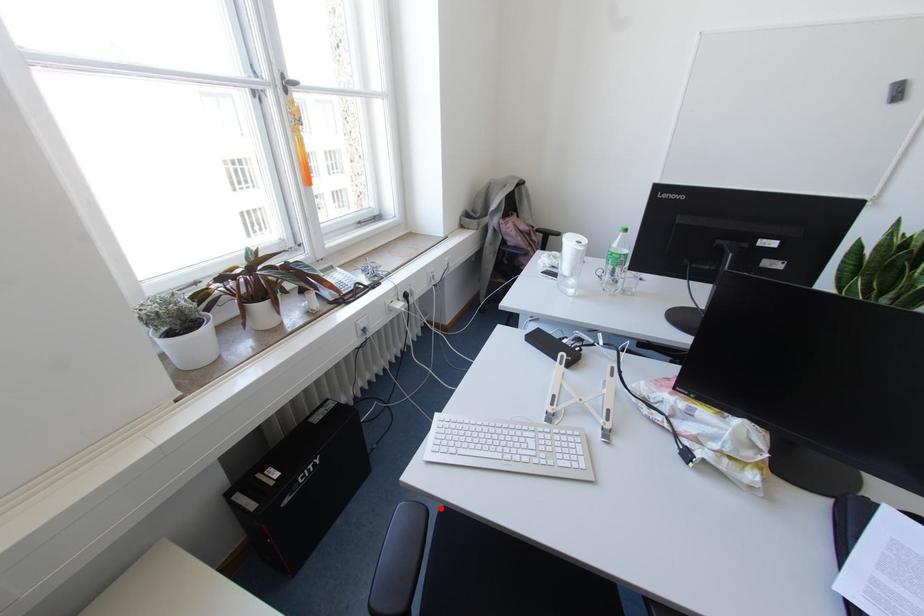
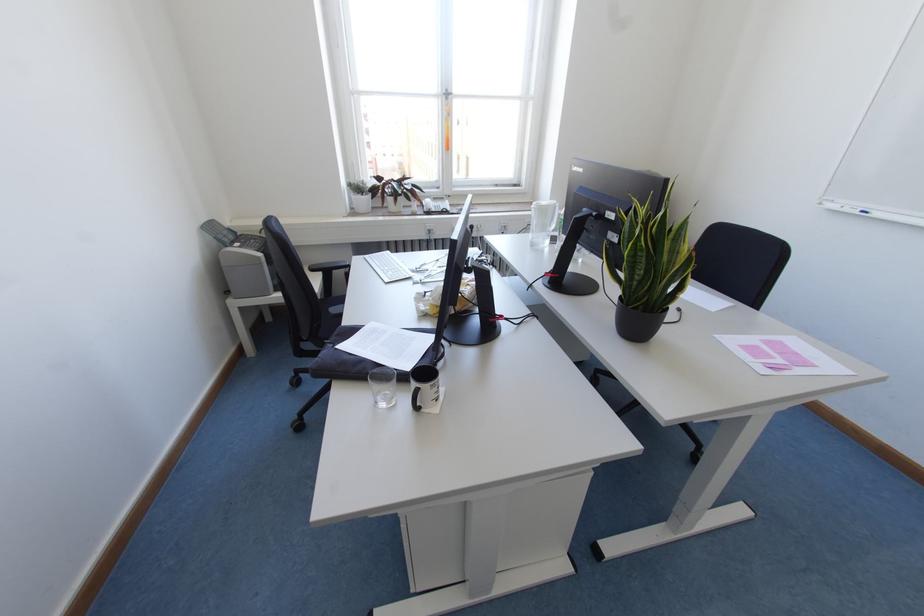
Question: I am providing you with two images of the same scene from different viewpoints. A red point is marked on the first image. Is the red point's position out of view in image 2?

Choices:
 (A) Yes
 (B) No

Answer: (A)